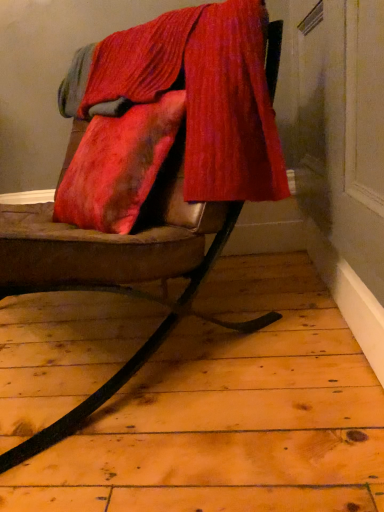
Question: Visually, is leather cushion at center positioned to the left or to the right of velvetvelvetvelvet at upper center?

Choices:
 (A) left
 (B) right

Answer: (A)

Question: Is leather cushion at center situated inside velvetvelvetvelvet at upper center or outside?

Choices:
 (A) inside
 (B) outside

Answer: (B)

Question: Looking at their shapes, would you say leather cushion at center is wider or thinner than velvetvelvetvelvet at upper center?

Choices:
 (A) thin
 (B) wide

Answer: (B)

Question: From the image's perspective, relative to leather cushion at center, is velvetvelvetvelvet at upper center above or below?

Choices:
 (A) above
 (B) below

Answer: (A)

Question: From a real-world perspective, is velvetvelvetvelvet at upper center positioned above or below leather cushion at center?

Choices:
 (A) above
 (B) below

Answer: (A)

Question: Considering the positions of point pyautogui.click(x=193, y=83) and point pyautogui.click(x=183, y=294), is point pyautogui.click(x=193, y=83) closer or farther from the camera than point pyautogui.click(x=183, y=294)?

Choices:
 (A) farther
 (B) closer

Answer: (A)

Question: Based on their sizes in the image, would you say velvetvelvetvelvet at upper center is bigger or smaller than leather cushion at center?

Choices:
 (A) big
 (B) small

Answer: (B)